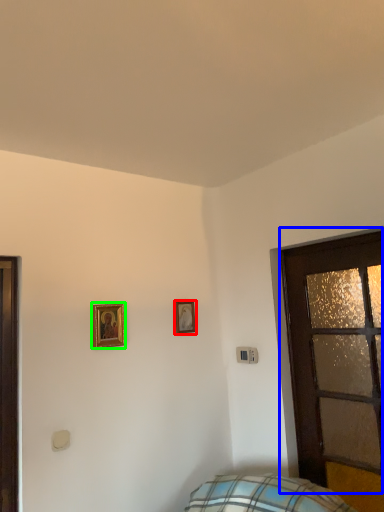
Question: Which object is the closest to the picture frame (highlighted by a red box)? Choose among these: door (highlighted by a blue box) or picture frame (highlighted by a green box).

Choices:
 (A) door
 (B) picture frame

Answer: (B)